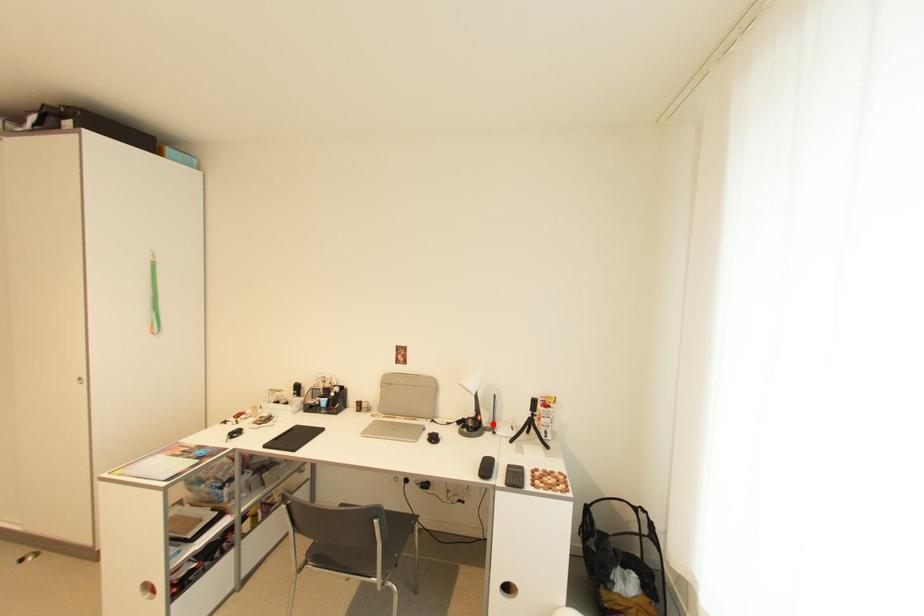
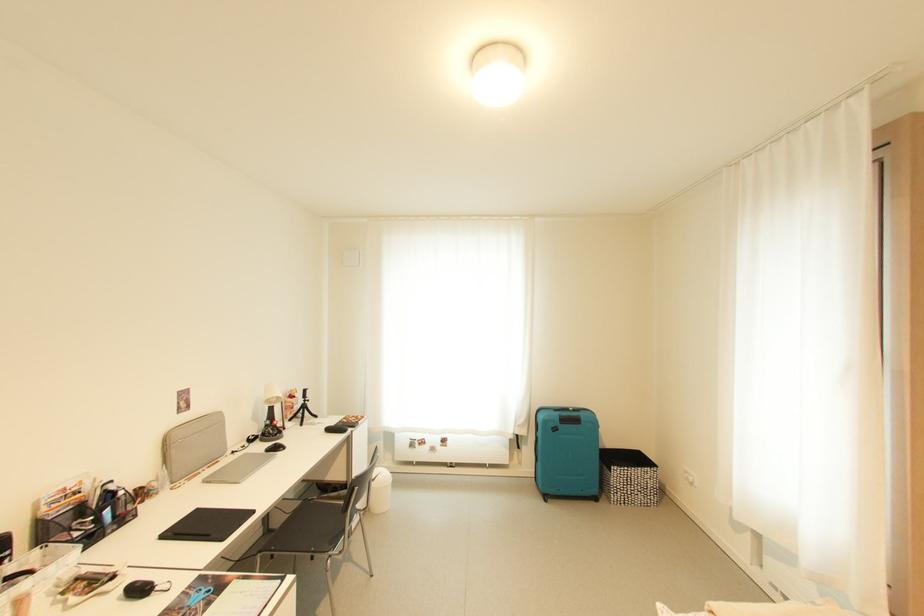
Question: I am providing you with two images of the same scene from different viewpoints. Image1 has a red point marked. In image2, the corresponding 3D location appears at what relative position? Reply with the corresponding letter.

Choices:
 (A) Closer
 (B) Farther

Answer: (A)